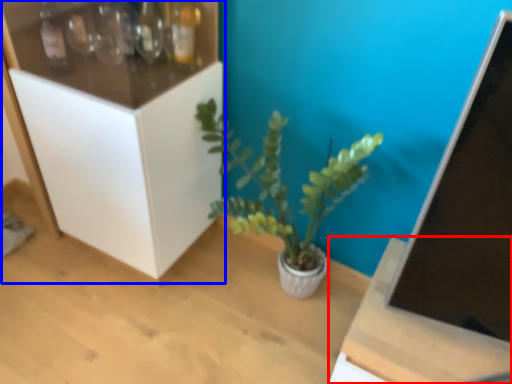
Question: Which point is closer to the camera, table (highlighted by a red box) or cabinetry (highlighted by a blue box)?

Choices:
 (A) table
 (B) cabinetry

Answer: (A)